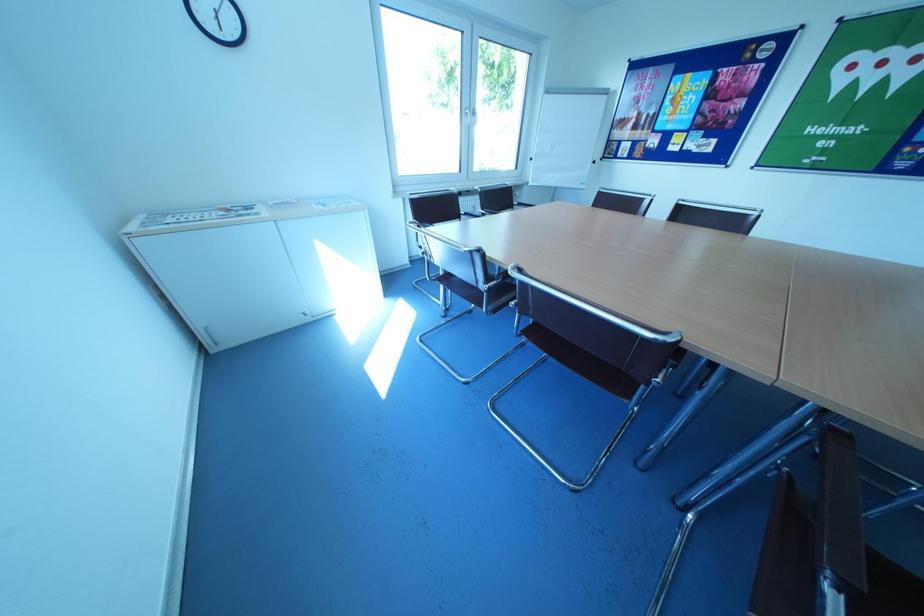
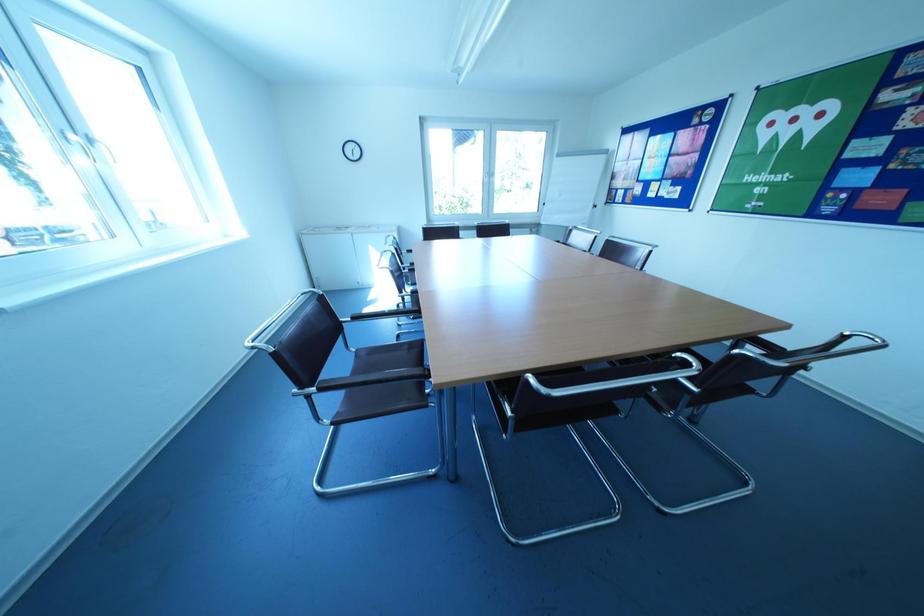
Which direction would the cameraman need to move to produce the second image?

The movement direction of the cameraman is right, backward.